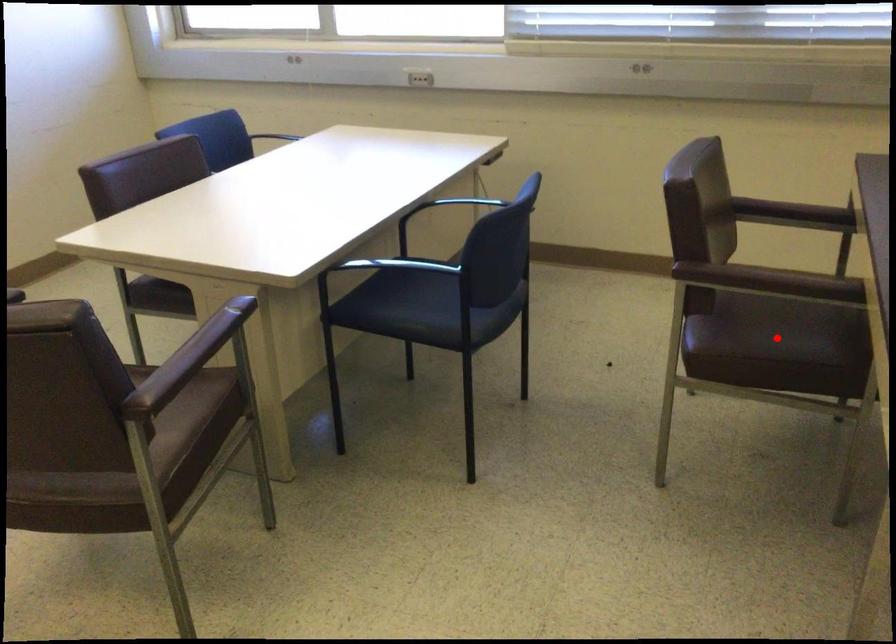
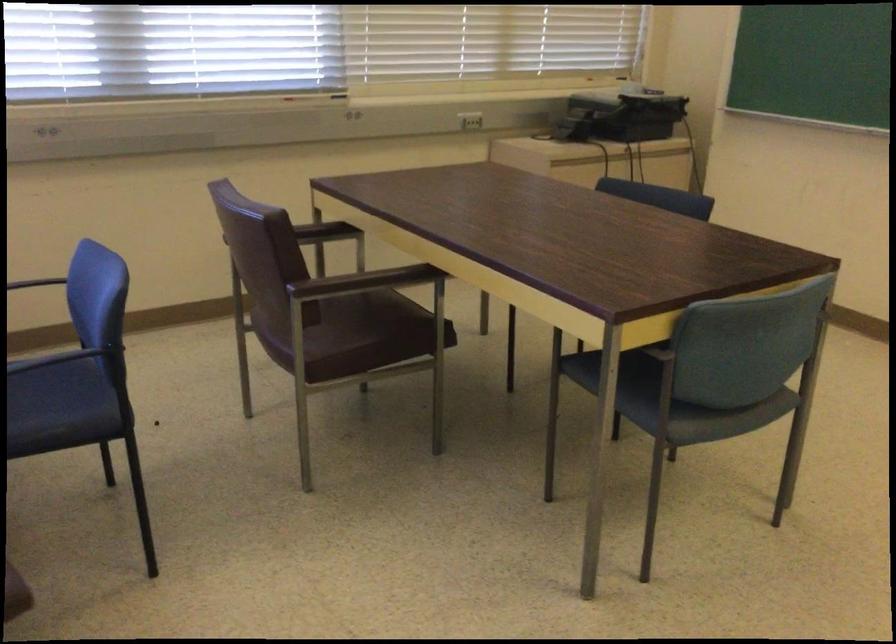
Question: I am providing you with two images of the same scene from different viewpoints. Given a red point in image1, look at the same physical point in image2. Is it:

Choices:
 (A) Closer to the viewpoint
 (B) Farther from the viewpoint

Answer: (B)